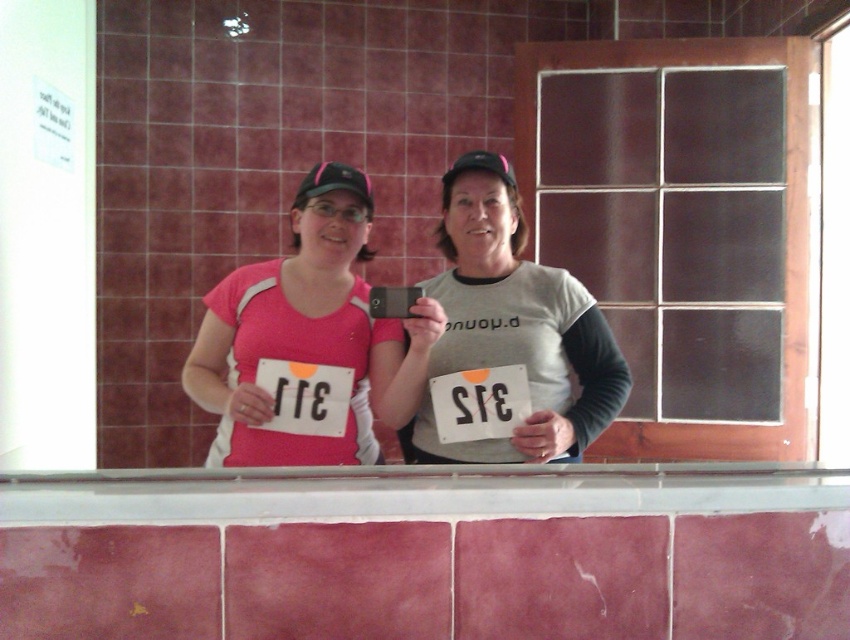
You are organizing a photo shoot and need to ensure that the matte pink shirt at center and the black paper at center are visible in the frame. Based on their positions, which object is more likely to be fully visible if the camera is positioned to capture the center area?

The matte pink shirt at center is wider than the black paper at center, so it is more likely to be fully visible in the frame when the camera is positioned to capture the center area.

You are a participant at the race registration. You need to place your race bib on the counter. The race bib is matte like your pink shirt. Where should you place it to avoid slipping? The white glossy ledge at center is below the matte pink shirt at center.

Since the white glossy ledge at center is below the matte pink shirt at center, placing the matte race bib on the matte pink shirt at center would prevent slipping, as glossy surfaces are more slippery than matte ones.